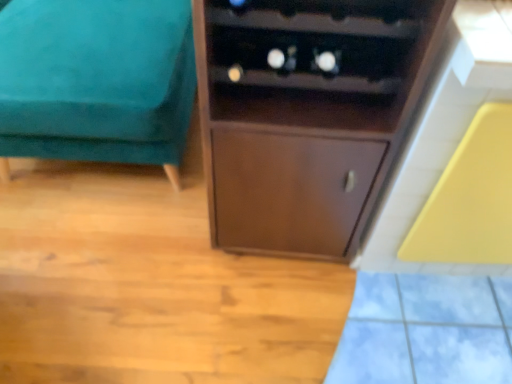
Where is `vacant area situated to the left side of brown wood cupboard at center`? This screenshot has width=512, height=384. vacant area situated to the left side of brown wood cupboard at center is located at coordinates (159, 235).